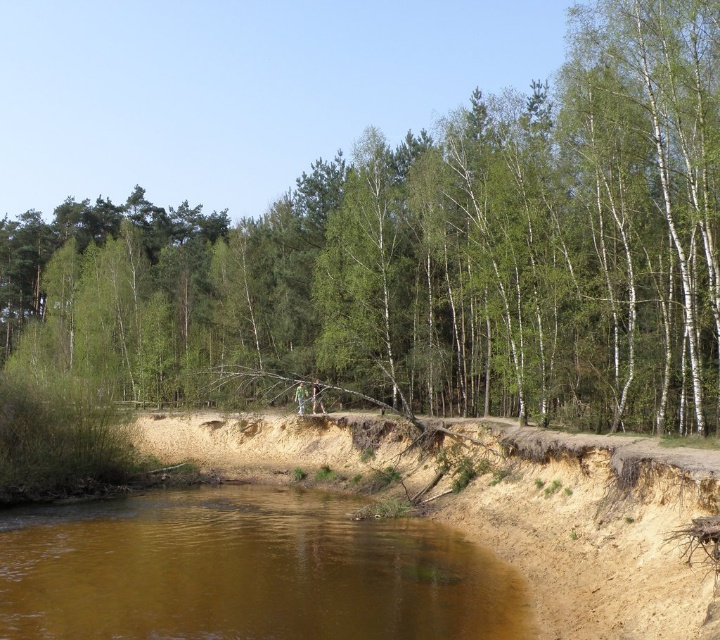
Between green leafy tree at center and brown sandy river at lower center, which one has less height?

Standing shorter between the two is brown sandy river at lower center.

Can you confirm if green leafy tree at center is wider than brown sandy river at lower center?

Yes.

Image resolution: width=720 pixels, height=640 pixels. I want to click on green leafy tree at center, so click(472, 243).